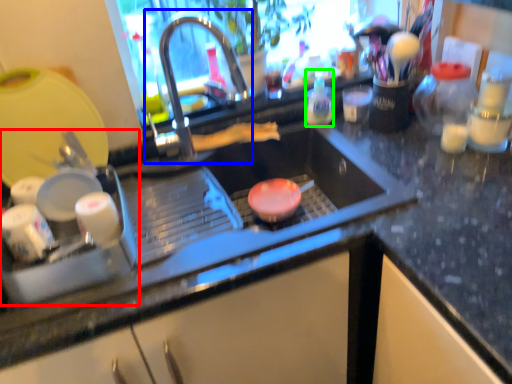
Question: Based on their relative distances, which object is nearer to appliance (highlighted by a red box)? Choose from tap (highlighted by a blue box) and bottle (highlighted by a green box).

Choices:
 (A) tap
 (B) bottle

Answer: (A)